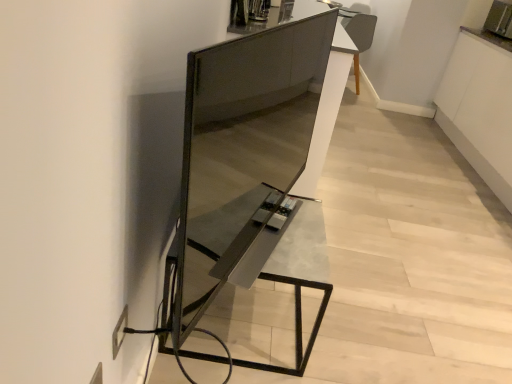
Question: Is metallic silver toaster at upper right not close to satin black tv stand at center?

Choices:
 (A) yes
 (B) no

Answer: (A)

Question: Is metallic silver toaster at upper right at the left side of satin black tv stand at center?

Choices:
 (A) no
 (B) yes

Answer: (A)

Question: Can you confirm if metallic silver toaster at upper right is wider than satin black tv stand at center?

Choices:
 (A) no
 (B) yes

Answer: (B)

Question: From the image's perspective, is metallic silver toaster at upper right beneath satin black tv stand at center?

Choices:
 (A) yes
 (B) no

Answer: (B)

Question: Is metallic silver toaster at upper right completely or partially outside of satin black tv stand at center?

Choices:
 (A) yes
 (B) no

Answer: (A)

Question: Is metallic silver toaster at upper right wider or thinner than metallic gray table at center?

Choices:
 (A) thin
 (B) wide

Answer: (A)

Question: In the image, is metallic silver toaster at upper right positioned in front of or behind metallic gray table at center?

Choices:
 (A) behind
 (B) front

Answer: (A)

Question: From a real-world perspective, relative to metallic gray table at center, is metallic silver toaster at upper right vertically above or below?

Choices:
 (A) above
 (B) below

Answer: (A)

Question: From the image's perspective, relative to metallic gray table at center, is metallic silver toaster at upper right above or below?

Choices:
 (A) above
 (B) below

Answer: (A)

Question: Is satin black tv stand at center in front of or behind metallic gray table at center in the image?

Choices:
 (A) front
 (B) behind

Answer: (A)

Question: Is satin black tv stand at center bigger or smaller than metallic gray table at center?

Choices:
 (A) small
 (B) big

Answer: (A)

Question: From a real-world perspective, is satin black tv stand at center physically located above or below metallic gray table at center?

Choices:
 (A) below
 (B) above

Answer: (B)

Question: Is satin black tv stand at center spatially inside metallic gray table at center, or outside of it?

Choices:
 (A) outside
 (B) inside

Answer: (A)

Question: Is metallic gray table at center in front of or behind metallic silver toaster at upper right in the image?

Choices:
 (A) front
 (B) behind

Answer: (A)

Question: Considering the positions of point (239, 253) and point (487, 26), is point (239, 253) closer or farther from the camera than point (487, 26)?

Choices:
 (A) closer
 (B) farther

Answer: (A)